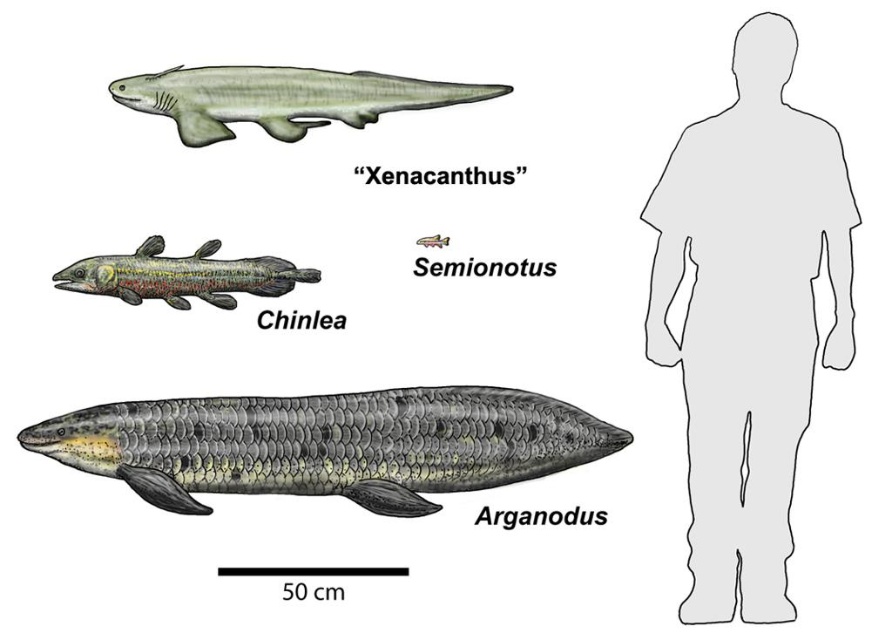
You are an underwater explorer looking at two fish in the image. The shiny metallic fish at center and the shiny silver fish at upper center. Which fish is positioned lower in the image?

The shiny metallic fish at center is located below the shiny silver fish at upper center, so it is positioned lower in the image.

You are an underwater photographer aiming to capture both the shiny metallic fish at center and the shiny silver fish at upper center in a single frame. Which fish should you focus on first to ensure both are in focus?

You should focus on the shiny metallic fish at center first since it is closer to the viewer than the shiny silver fish at upper center, allowing both to be in focus when using a proper aperture setting.

You are a marine biologist studying the prehistoric fish species in the image. You need to determine the relative positions of the fish and the human silhouette. Which fish is positioned higher up in the image compared to the silhouette figure at center?

The Xenacanthus is positioned higher up in the image compared to the silhouette figure at center, as it is placed at the top while the silhouette is at the center.